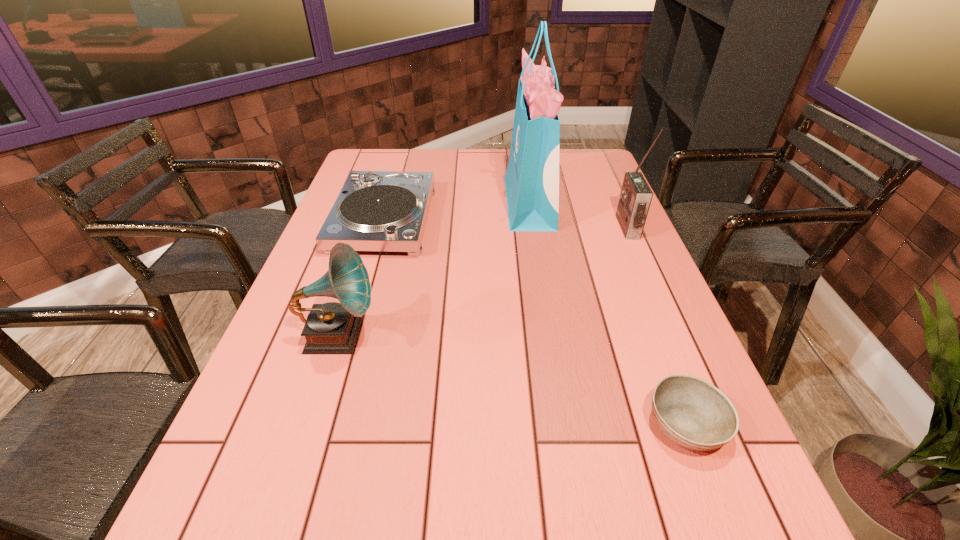
You are a GUI agent. You are given a task and a screenshot of the screen. Output one action in this format:
    pyautogui.click(x=<x>, y=<y>)
    Task: Click on the third object from right to left
    This screenshot has width=960, height=540.
    Given the screenshot: What is the action you would take?
    pyautogui.click(x=532, y=178)

The height and width of the screenshot is (540, 960). I want to click on shopping bag, so click(532, 178).

Where is `the second tallest object`? the second tallest object is located at coordinates (635, 198).

Image resolution: width=960 pixels, height=540 pixels. In order to click on the third shortest object in this screenshot , I will do `click(331, 328)`.

I want to click on the second nearest object, so click(x=331, y=328).

You are a GUI agent. You are given a task and a screenshot of the screen. Output one action in this format:
    pyautogui.click(x=<x>, y=<y>)
    Task: Click on the fourth tallest object
    
    Given the screenshot: What is the action you would take?
    pyautogui.click(x=376, y=210)

The height and width of the screenshot is (540, 960). Identify the location of the nearest object. (693, 413).

The image size is (960, 540). Identify the location of bowl. (693, 413).

Where is `free space located on the left of the shopping bag`? This screenshot has height=540, width=960. free space located on the left of the shopping bag is located at coordinates tap(405, 202).

Image resolution: width=960 pixels, height=540 pixels. What are the coordinates of `blank space located 0.130m on the display of the fourth shortest object` in the screenshot? It's located at (576, 227).